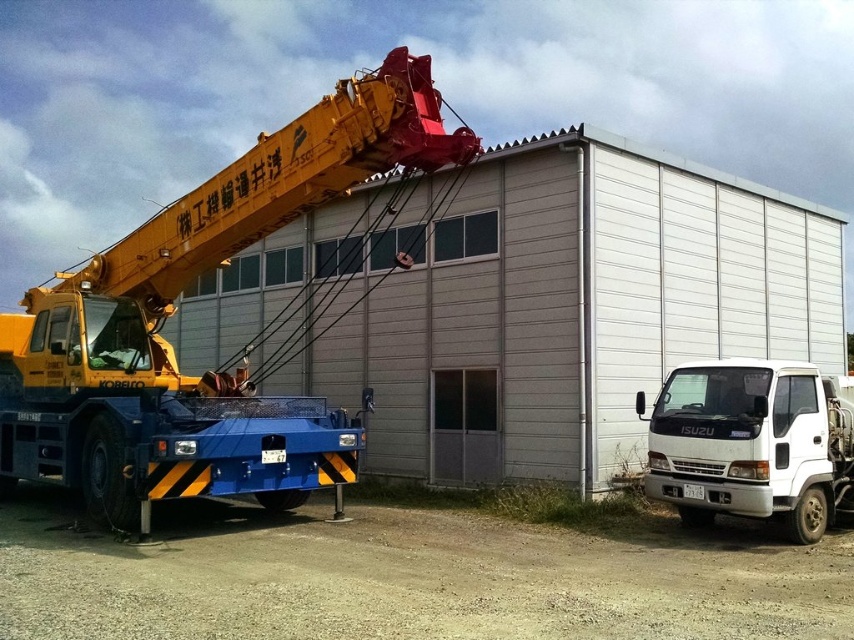
Can you confirm if yellow metallic crane at left is positioned to the right of white matte truck at lower right?

Incorrect, yellow metallic crane at left is not on the right side of white matte truck at lower right.

Which is behind, point (431, 104) or point (668, 433)?

Point (668, 433)

Is point (284, 440) behind point (741, 468)?

Yes, it is.

Locate an element on the screen. This screenshot has height=640, width=854. yellow metallic crane at left is located at coordinates (174, 308).